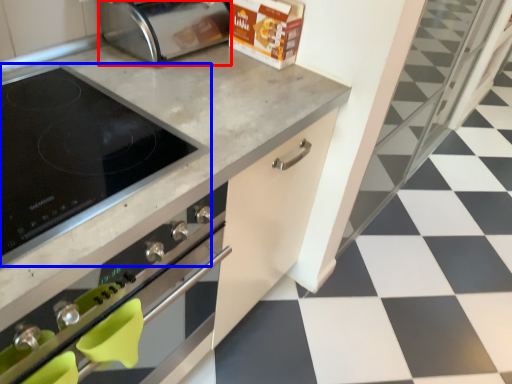
Question: Which of the following is the farthest to the observer, toaster (highlighted by a red box) or kitchen appliance (highlighted by a blue box)?

Choices:
 (A) toaster
 (B) kitchen appliance

Answer: (A)